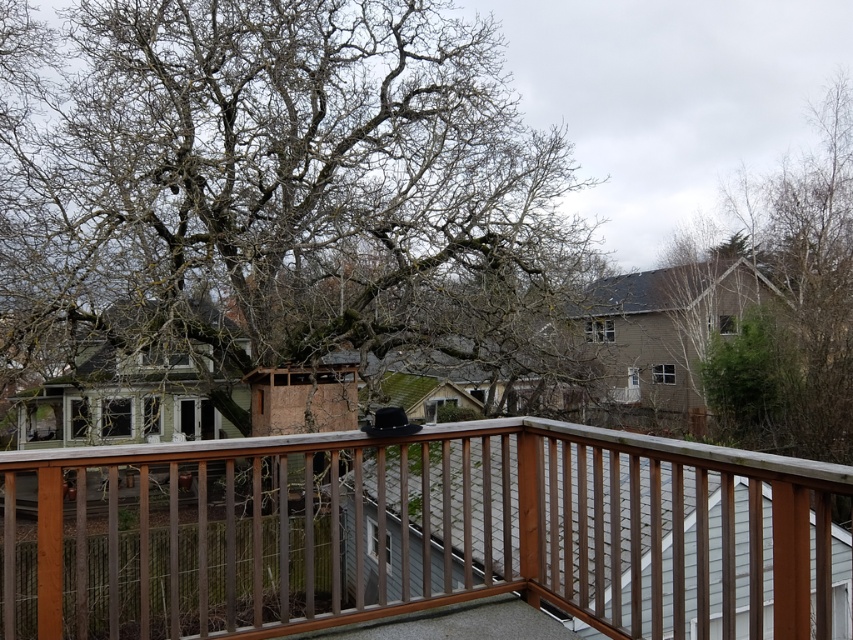
Who is taller, bare branches at center or brown wood railing at center?

Standing taller between the two is bare branches at center.

Does point (16, 173) come farther from viewer compared to point (701, 618)?

Yes.

Where is `bare branches at center`? The width and height of the screenshot is (853, 640). bare branches at center is located at coordinates (277, 189).